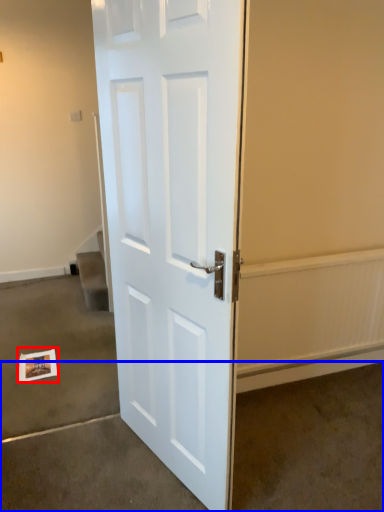
Question: Among these objects, which one is nearest to the camera, postcard (highlighted by a red box) or concrete (highlighted by a blue box)?

Choices:
 (A) postcard
 (B) concrete

Answer: (B)